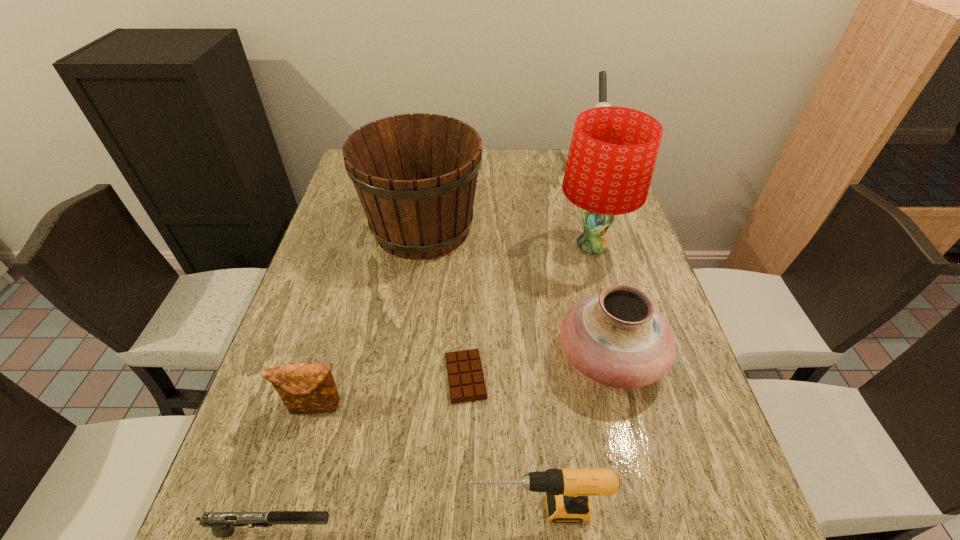
Where is `vacant area located 0.280m on the right of the shortest object`? Image resolution: width=960 pixels, height=540 pixels. vacant area located 0.280m on the right of the shortest object is located at coordinates [x=619, y=376].

Locate an element on the screen. The image size is (960, 540). object present at the far edge is located at coordinates (602, 74).

Where is `object that is at the near edge`? The width and height of the screenshot is (960, 540). object that is at the near edge is located at coordinates (222, 524).

Image resolution: width=960 pixels, height=540 pixels. In order to click on wine bucket that is positioned at the left edge in this screenshot , I will do `click(415, 174)`.

Identify the location of clutch bag located in the left edge section of the desktop. This screenshot has width=960, height=540. (305, 388).

Where is `gun located at the left edge`? This screenshot has height=540, width=960. gun located at the left edge is located at coordinates (222, 524).

The width and height of the screenshot is (960, 540). Identify the location of lampshade that is at the right edge. (613, 151).

Find the location of a particular element. microscope at the right edge is located at coordinates (602, 74).

Image resolution: width=960 pixels, height=540 pixels. I want to click on pottery situated at the right edge, so click(616, 337).

The image size is (960, 540). I want to click on object located at the near left corner, so click(222, 524).